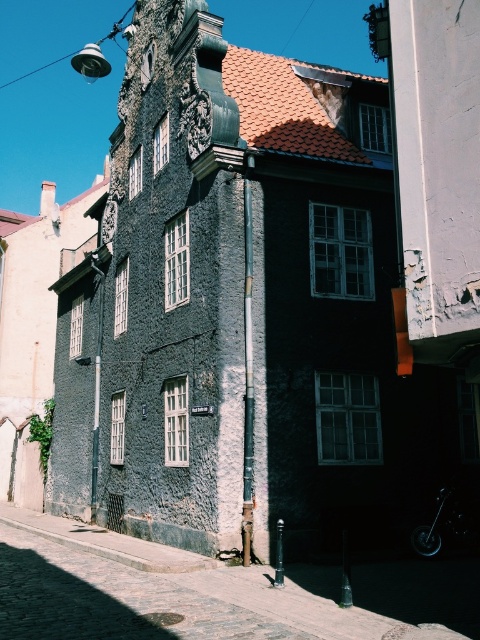
Question: Among these points, which one is farthest from the camera?

Choices:
 (A) (456, 506)
 (B) (415, 570)

Answer: (A)

Question: Considering the relative positions of cobblestone pavement at lower left and shiny metallic motorcycle at lower right in the image provided, where is cobblestone pavement at lower left located with respect to shiny metallic motorcycle at lower right?

Choices:
 (A) left
 (B) right

Answer: (A)

Question: Where is cobblestone pavement at lower left located in relation to shiny metallic motorcycle at lower right in the image?

Choices:
 (A) above
 (B) below

Answer: (B)

Question: Does cobblestone pavement at lower left appear on the left side of shiny metallic motorcycle at lower right?

Choices:
 (A) no
 (B) yes

Answer: (B)